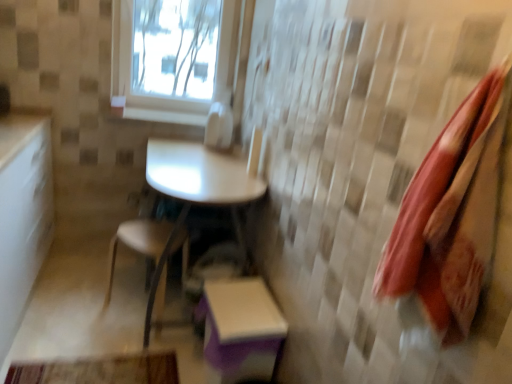
This screenshot has height=384, width=512. I want to click on vacant space situated on the left part of metallic silver chair at center, so click(57, 311).